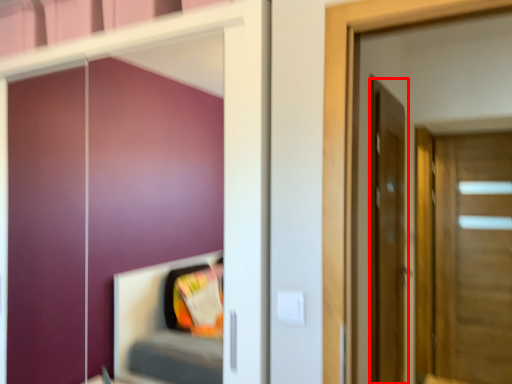
Question: From the image, what is the correct spatial relationship of door (annotated by the red box) in relation to door?

Choices:
 (A) left
 (B) right

Answer: (A)